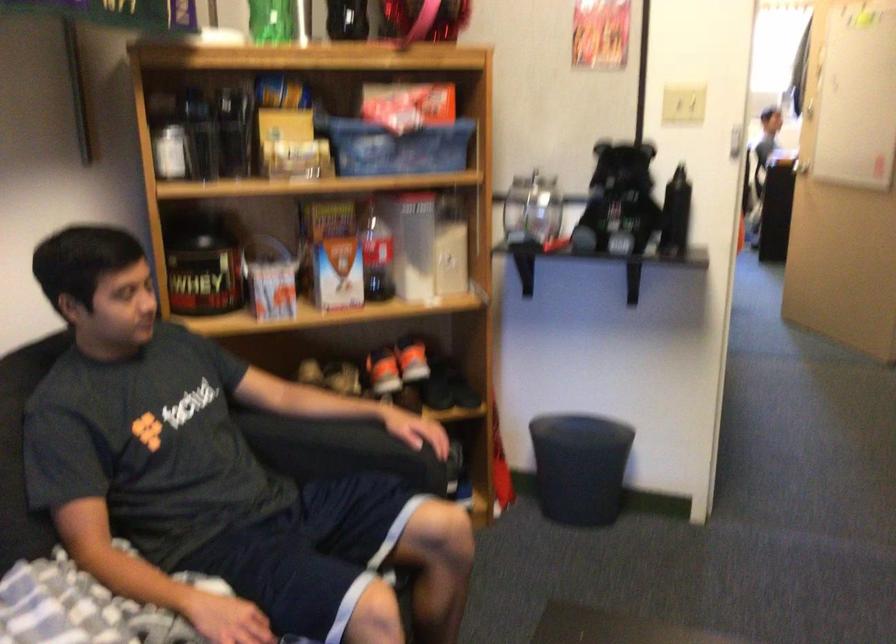
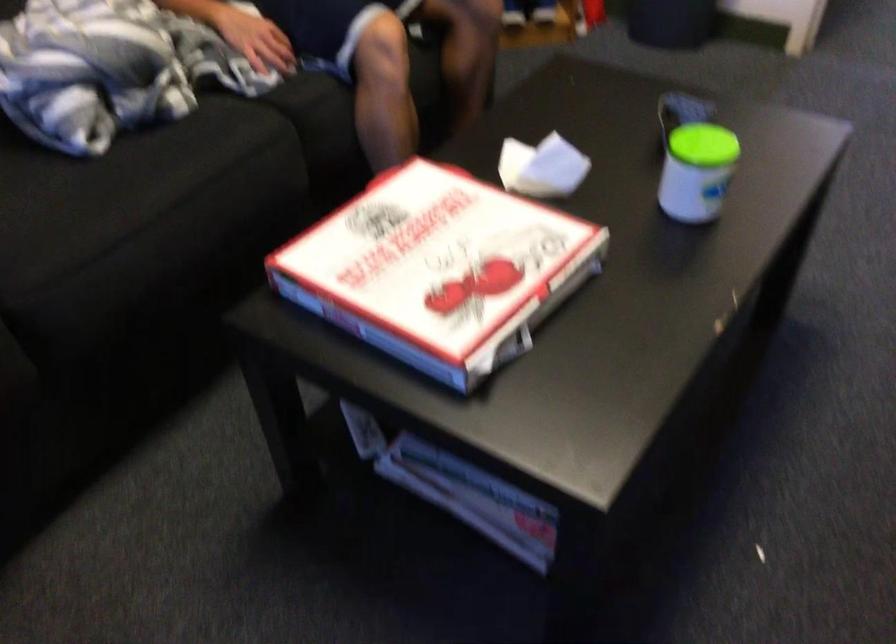
Question: Based on the continuous images, in which direction is the camera rotating? Reply with the corresponding letter.

Choices:
 (A) Left
 (B) Right
 (C) Up
 (D) Down

Answer: (D)